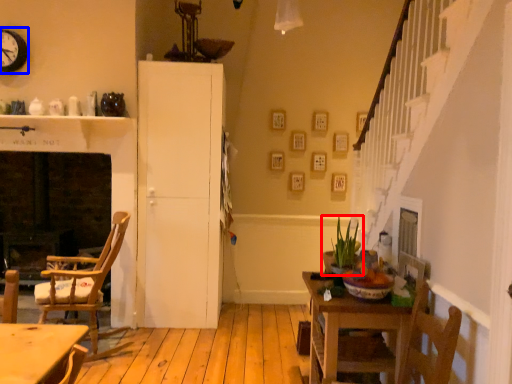
Question: Which point is further to the camera, houseplant (highlighted by a red box) or clock (highlighted by a blue box)?

Choices:
 (A) houseplant
 (B) clock

Answer: (B)